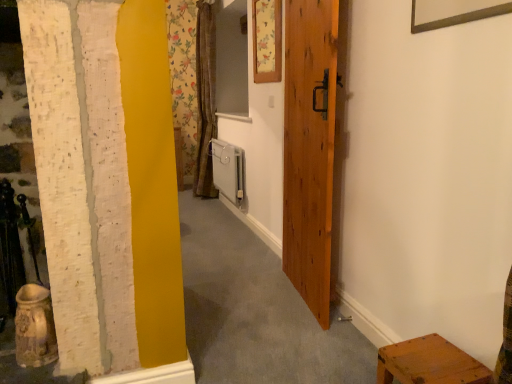
Question: Should I look upward or downward to see white plastic radiator at center?

Choices:
 (A) up
 (B) down

Answer: (A)

Question: Is wooden door at center turned away from wooden stool at lower right?

Choices:
 (A) yes
 (B) no

Answer: (B)

Question: From a real-world perspective, is wooden door at center under wooden stool at lower right?

Choices:
 (A) yes
 (B) no

Answer: (B)

Question: Can we say wooden door at center lies outside wooden stool at lower right?

Choices:
 (A) yes
 (B) no

Answer: (A)

Question: From the image's perspective, is wooden door at center below wooden stool at lower right?

Choices:
 (A) no
 (B) yes

Answer: (A)

Question: Can you confirm if wooden door at center is thinner than wooden stool at lower right?

Choices:
 (A) yes
 (B) no

Answer: (A)

Question: Can you confirm if wooden door at center is positioned to the right of wooden stool at lower right?

Choices:
 (A) no
 (B) yes

Answer: (A)

Question: Is white plastic radiator at center not near floral paper picture frame at upper center?

Choices:
 (A) yes
 (B) no

Answer: (A)

Question: From the image's perspective, would you say white plastic radiator at center is shown under floral paper picture frame at upper center?

Choices:
 (A) yes
 (B) no

Answer: (A)

Question: Considering the relative positions of white plastic radiator at center and floral paper picture frame at upper center in the image provided, is white plastic radiator at center to the left of floral paper picture frame at upper center from the viewer's perspective?

Choices:
 (A) yes
 (B) no

Answer: (A)

Question: Is white plastic radiator at center aimed at floral paper picture frame at upper center?

Choices:
 (A) yes
 (B) no

Answer: (B)

Question: Can you confirm if white plastic radiator at center is thinner than floral paper picture frame at upper center?

Choices:
 (A) yes
 (B) no

Answer: (B)

Question: Is white plastic radiator at center placed right next to floral paper picture frame at upper center?

Choices:
 (A) no
 (B) yes

Answer: (A)

Question: Is wooden stool at lower right oriented towards wooden door at center?

Choices:
 (A) no
 (B) yes

Answer: (A)